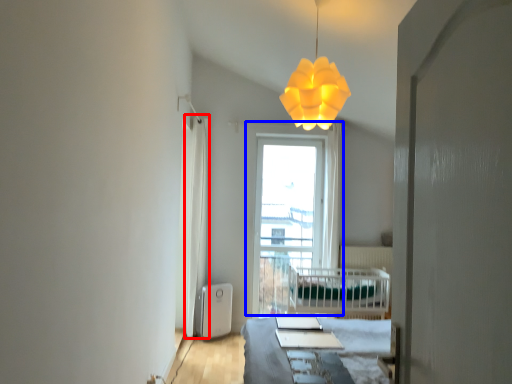
Question: Among these objects, which one is nearest to the camera, curtain (highlighted by a red box) or window (highlighted by a blue box)?

Choices:
 (A) curtain
 (B) window

Answer: (A)